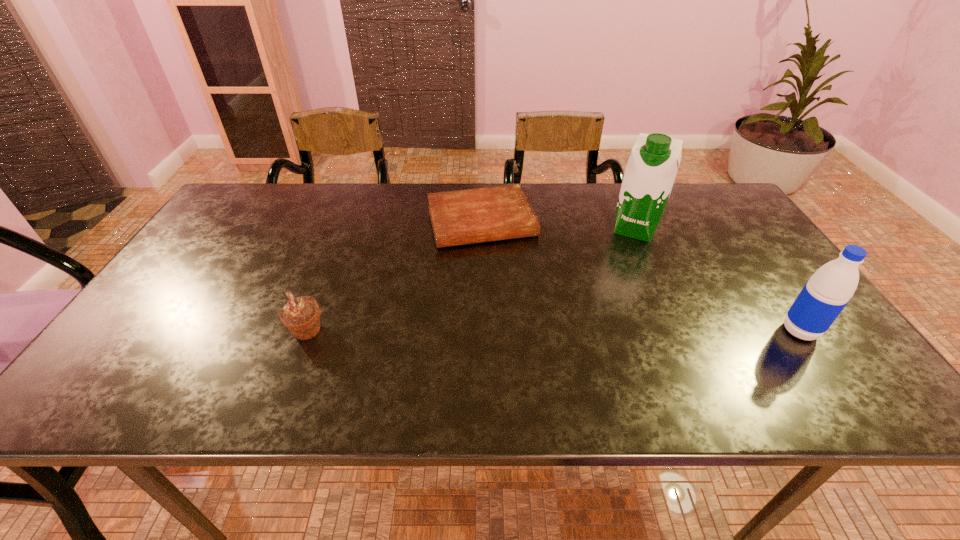
This screenshot has width=960, height=540. I want to click on the third tallest object, so click(x=301, y=315).

At what (x,y) coordinates should I click in order to perform the action: click on muffin. Please return your answer as a coordinate pair (x, y). The width and height of the screenshot is (960, 540). Looking at the image, I should click on (301, 315).

The height and width of the screenshot is (540, 960). I want to click on the third shortest object, so [x=825, y=295].

Locate an element on the screen. the rightmost object is located at coordinates (825, 295).

Identify the location of the tallest object. The image size is (960, 540). (651, 170).

At what (x,y) coordinates should I click in order to perform the action: click on soya milk. Please return your answer as a coordinate pair (x, y). Looking at the image, I should click on (651, 170).

Locate an element on the screen. The image size is (960, 540). the shortest object is located at coordinates (460, 217).

Image resolution: width=960 pixels, height=540 pixels. I want to click on the third object from right to left, so click(x=460, y=217).

This screenshot has height=540, width=960. I want to click on vacant space located on the left of the third tallest object, so click(267, 331).

Locate an element on the screen. free space located on the left of the water bottle is located at coordinates (747, 331).